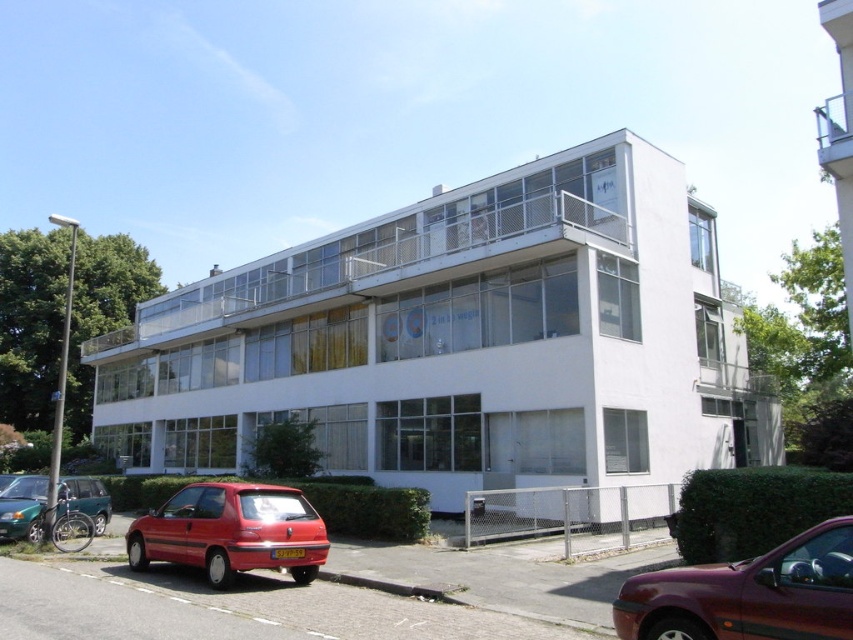
You are a delivery person trying to park your motorcycle in front of the building. The motorcycle requires a space that is not blocked by the clear glass balcony at center or the matte red hatchback at lower left. Based on the scene, where should you park your motorcycle?

The clear glass balcony at center is to the left of the matte red hatchback at lower left. Since the motorcycle needs a space not blocked by either object, you should park it to the right of the matte red hatchback at lower left, away from both obstacles.

You are standing at the entrance of the building and see two points marked on the ground. The first point is at location point (662, 636) and the second is at point (25, 476). Which point is closer to you?

Point (25, 476) is closer to you because it is behind point (662, 636), which is in front of it.

Looking at this image, you are a delivery person approaching the building and need to park the maroon metallic car at lower right. Can you park it in front of the clear glass balcony at center?

The maroon metallic car at lower right is behind the clear glass balcony at center, so it cannot be parked in front of the clear glass balcony at center.